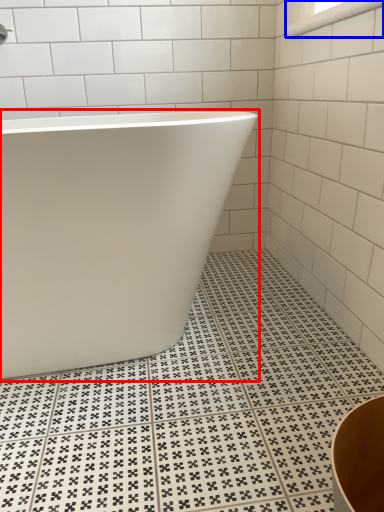
Question: Among these objects, which one is nearest to the camera, bathtub (highlighted by a red box) or window (highlighted by a blue box)?

Choices:
 (A) bathtub
 (B) window

Answer: (A)